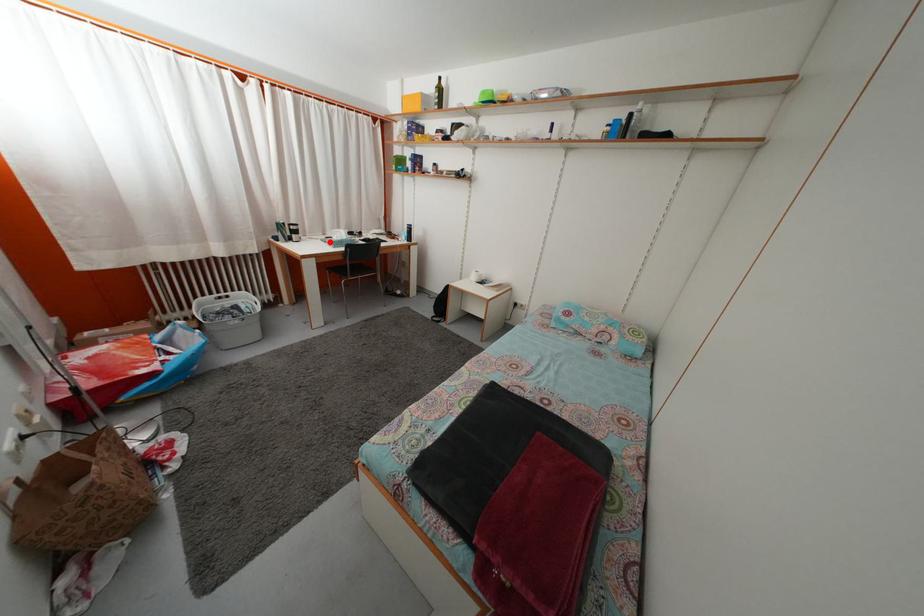
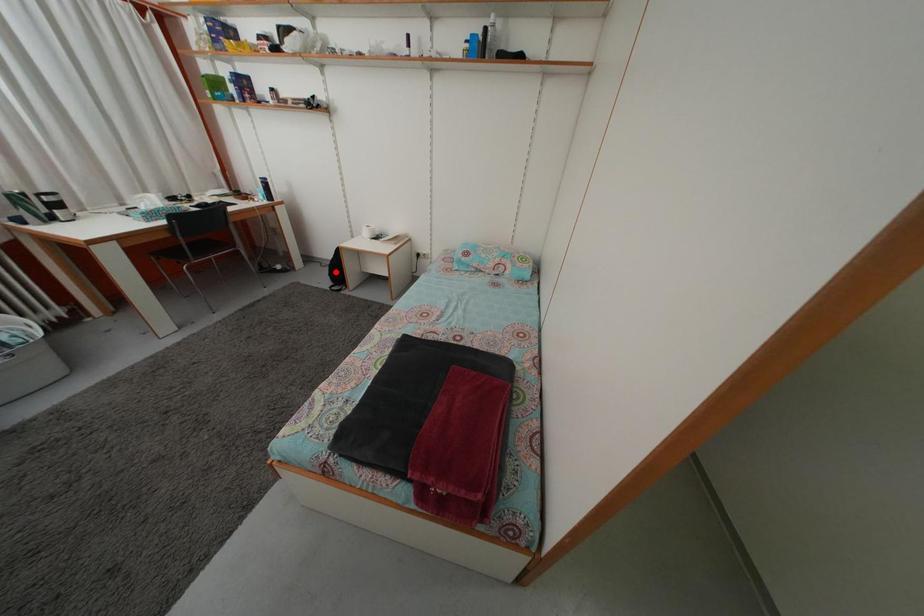
I am providing you with two images of the same scene from different viewpoints. A red point is marked on the first image and another point is marked on the second image. Is the red point in image1 aligned with the point shown in image2?

No